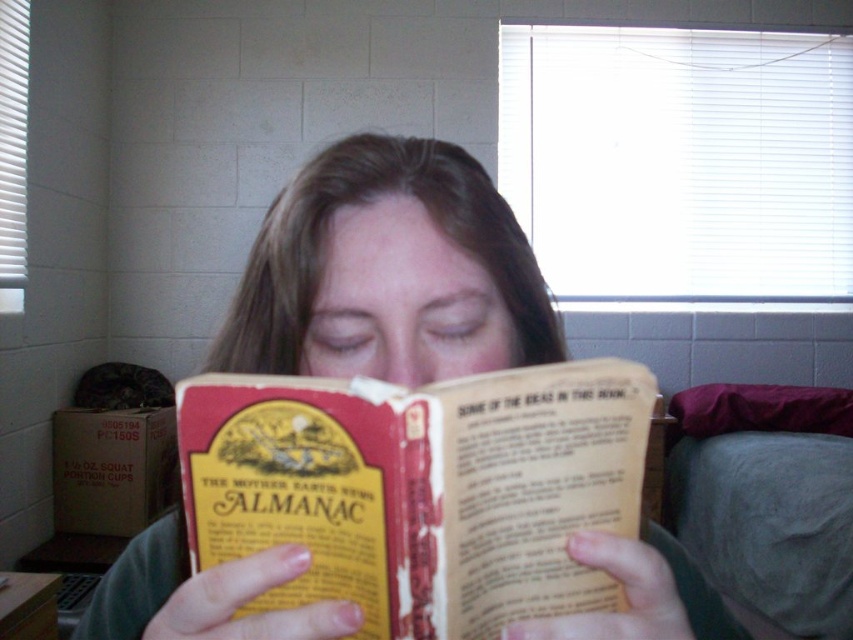
From the picture: Can you confirm if yellow paper almanac at center is shorter than smooth brown hair at center?

Indeed, yellow paper almanac at center has a lesser height compared to smooth brown hair at center.

Which of these two, yellow paper almanac at center or smooth brown hair at center, stands shorter?

Standing shorter between the two is yellow paper almanac at center.

I want to click on yellow paper almanac at center, so pos(421,490).